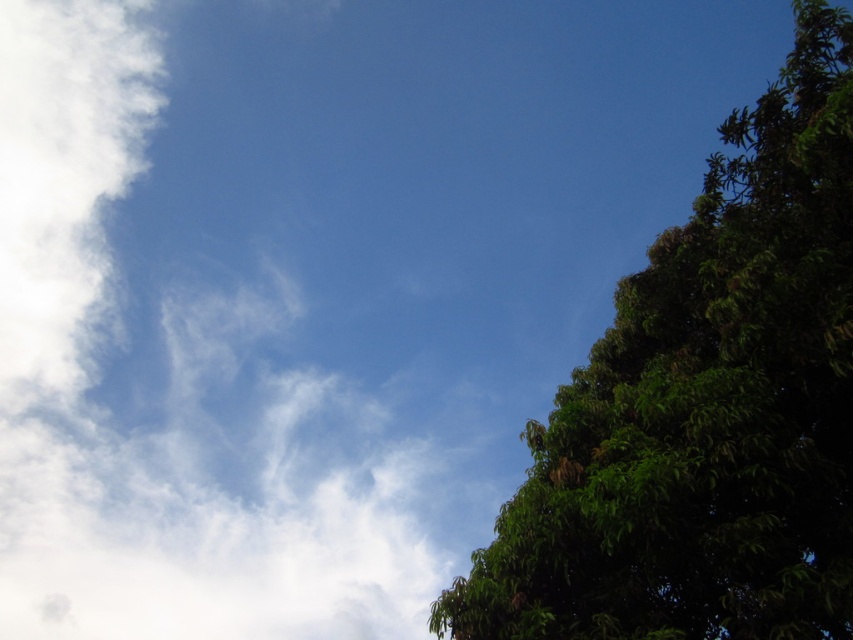
Who is shorter, white fluffy cloud at upper left or green leafy tree at right?

green leafy tree at right

Who is lower down, white fluffy cloud at upper left or green leafy tree at right?

Positioned lower is green leafy tree at right.

Find the location of a particular element. Image resolution: width=853 pixels, height=640 pixels. white fluffy cloud at upper left is located at coordinates (167, 403).